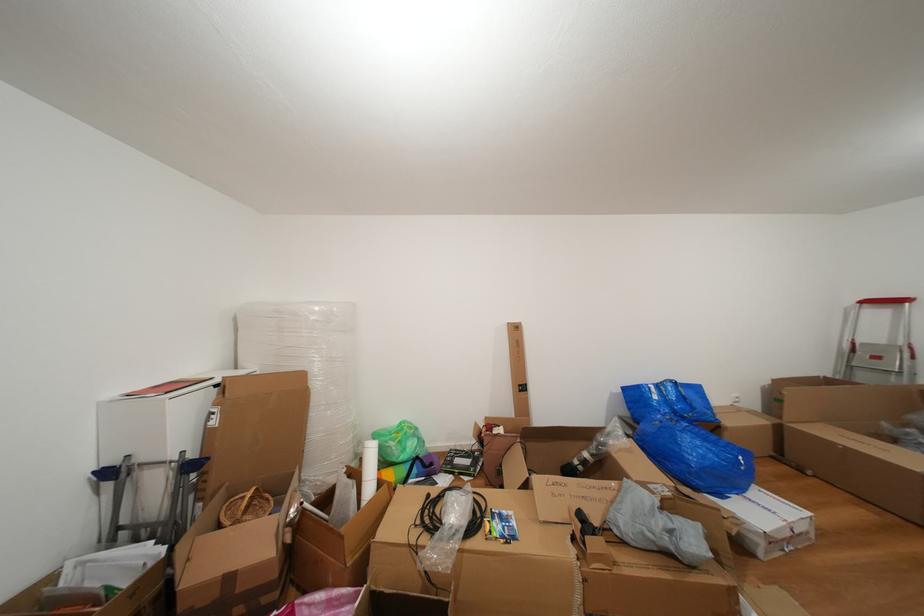
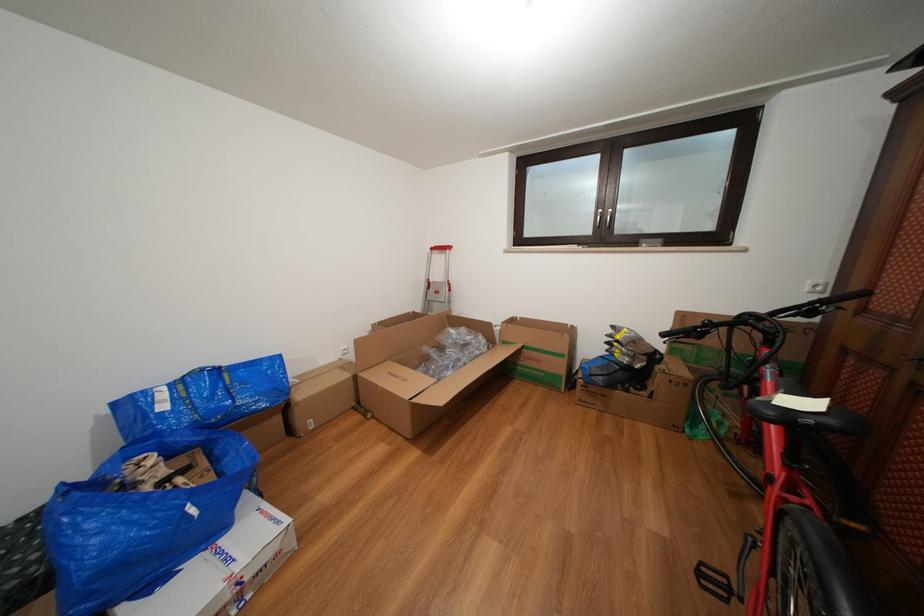
The point at (684, 389) is marked in the first image. Where is the corresponding point in the second image?

(225, 376)